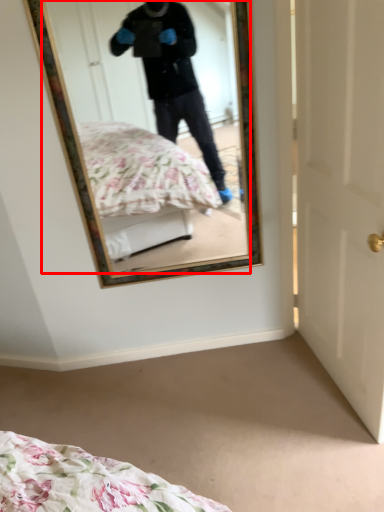
Question: From the image's perspective, considering the relative positions of mirror (annotated by the red box) and door in the image provided, where is mirror (annotated by the red box) located with respect to the staircase?

Choices:
 (A) below
 (B) above

Answer: (B)